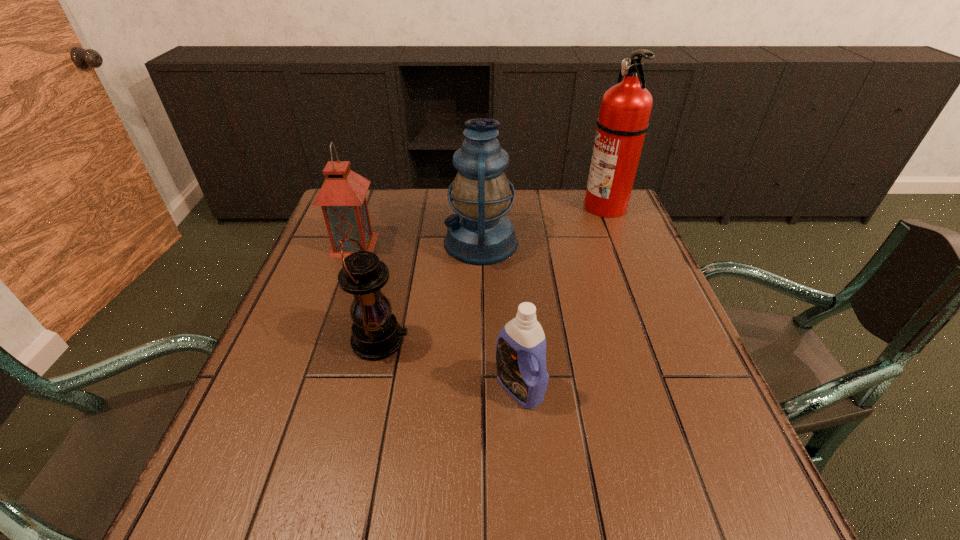
Locate an element on the screen. This screenshot has width=960, height=540. blank region between the tallest object and the nearest object is located at coordinates (563, 296).

Find the location of a particular element. The width and height of the screenshot is (960, 540). empty space between the nearest lantern and the rightmost object is located at coordinates (492, 273).

In order to click on blank region between the detergent and the leftmost object in this screenshot , I will do `click(437, 316)`.

Where is `free area in between the shortest object and the leftmost lantern`? Image resolution: width=960 pixels, height=540 pixels. free area in between the shortest object and the leftmost lantern is located at coordinates (437, 316).

Locate which object ranks in proximity to the second lantern from right to left. Please provide its 2D coordinates. Your answer should be formatted as a tuple, i.e. [(x, y)], where the tuple contains the x and y coordinates of a point satisfying the conditions above.

[(480, 233)]

Identify the location of object that is the second closest to the leftmost object. (376, 334).

Select which lantern appears as the closest to the fourth farthest object. Please provide its 2D coordinates. Your answer should be formatted as a tuple, i.e. [(x, y)], where the tuple contains the x and y coordinates of a point satisfying the conditions above.

[(480, 233)]

Locate which lantern ranks second in proximity to the nearest object. Please provide its 2D coordinates. Your answer should be formatted as a tuple, i.e. [(x, y)], where the tuple contains the x and y coordinates of a point satisfying the conditions above.

[(480, 233)]